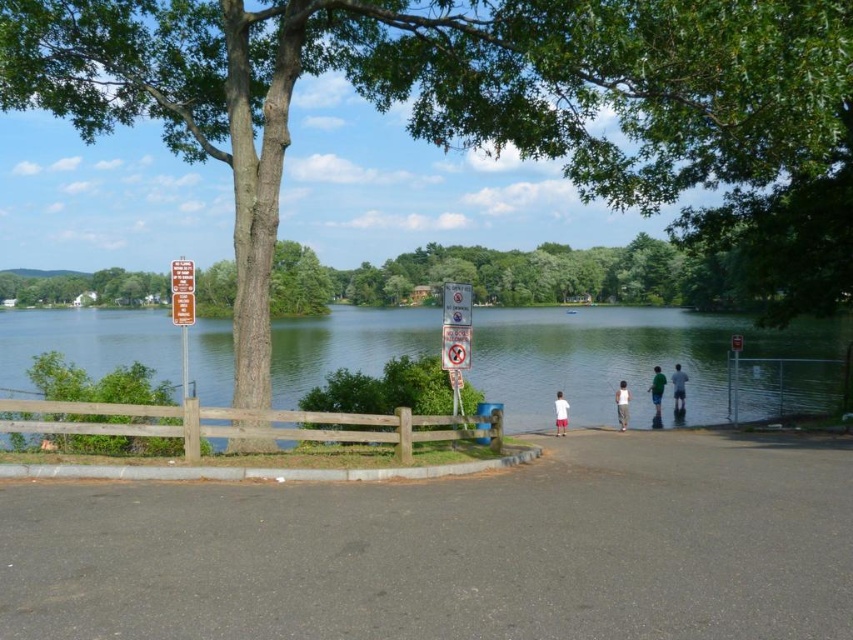
Question: Is white cotton shirt at center positioned at the back of green cotton shirt at lower center?

Choices:
 (A) no
 (B) yes

Answer: (A)

Question: Which object appears farthest from the camera in this image?

Choices:
 (A) green textured tree at center
 (B) green cotton shirt at lower center
 (C) white cotton shorts at center
 (D) white cotton shirt at center

Answer: (B)

Question: Which of the following is the farthest from the observer?

Choices:
 (A) light blue shirt at center
 (B) clear water at lower center

Answer: (A)

Question: Does white plastic sign at upper center have a larger size compared to light blue shirt at center?

Choices:
 (A) yes
 (B) no

Answer: (B)

Question: Which point is closer to the camera taking this photo?

Choices:
 (A) click(659, 384)
 (B) click(624, 417)

Answer: (B)

Question: Can you confirm if green textured tree at center is thinner than light blue shirt at center?

Choices:
 (A) no
 (B) yes

Answer: (A)